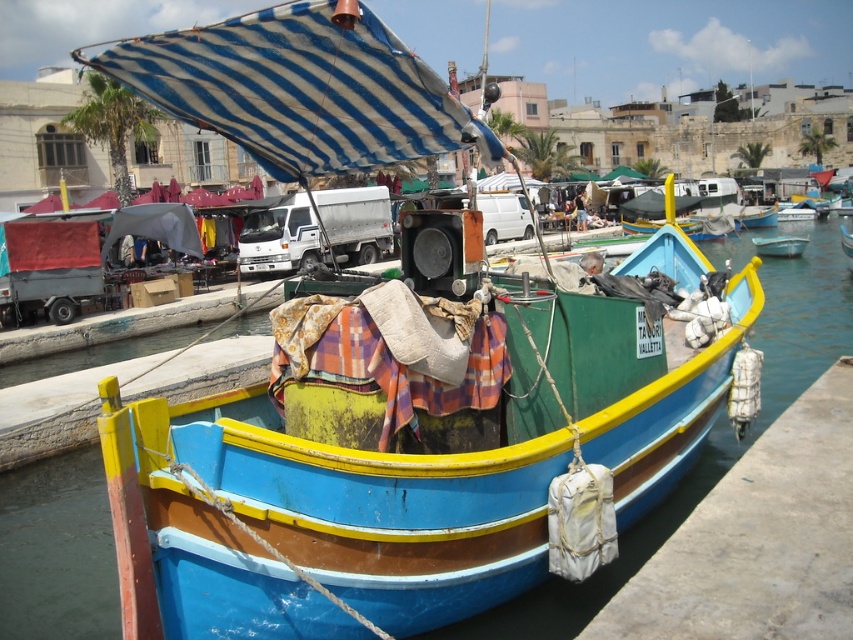
You are a harbor worker who needs to move a 26 meter long cargo container from the wooden boat at center to the light blue plastic boat at center. Is there enough space between the two boats to maneuver the container?

The wooden boat at center is 25.99 meters from the light blue plastic boat at center. Since the cargo container is 26 meters long, there is not enough space between the two boats to maneuver the container safely.

You are standing at the edge of the dock and want to reach a point that is 14.30 feet away from you. Can you confirm if the point marked at coordinates point (367, 588) is exactly that distance away?

The point marked at coordinates point (367, 588) is exactly 14.30 feet away from the viewer, so yes, it is the correct point.